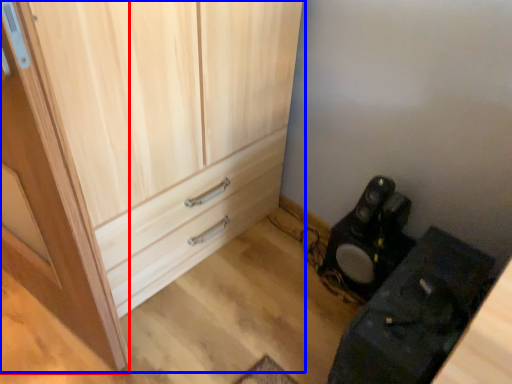
Question: Among these objects, which one is farthest to the camera, door (highlighted by a red box) or cupboard (highlighted by a blue box)?

Choices:
 (A) door
 (B) cupboard

Answer: (B)